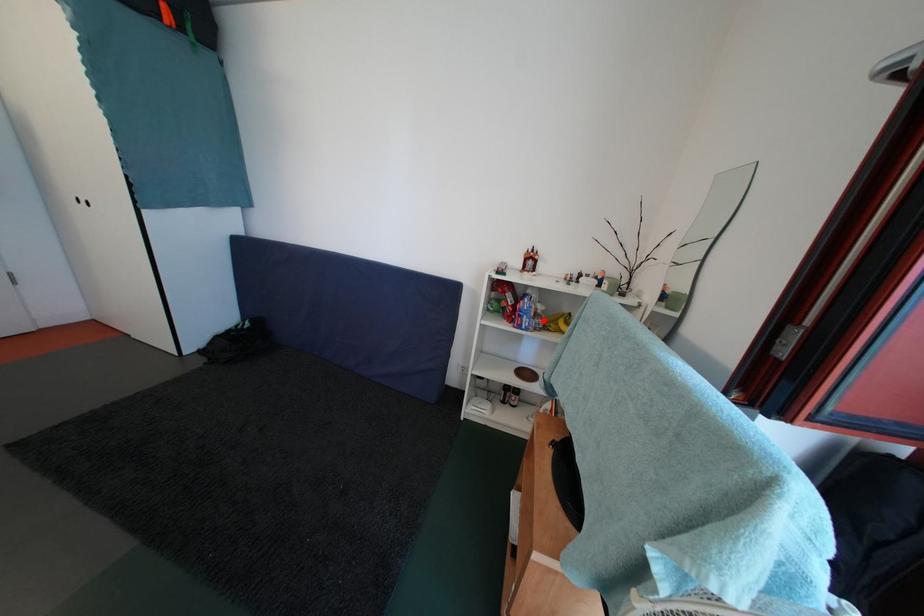
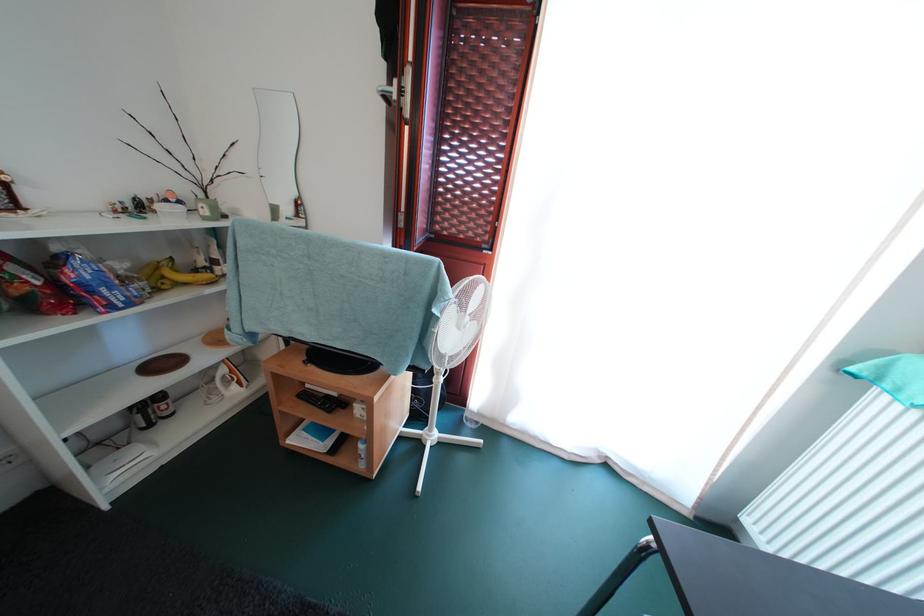
Question: I am providing you with two images of the same scene from different viewpoints. A red point is marked on the first image. Can you still see the location of the red point in image 2?

Choices:
 (A) Yes
 (B) No

Answer: (A)